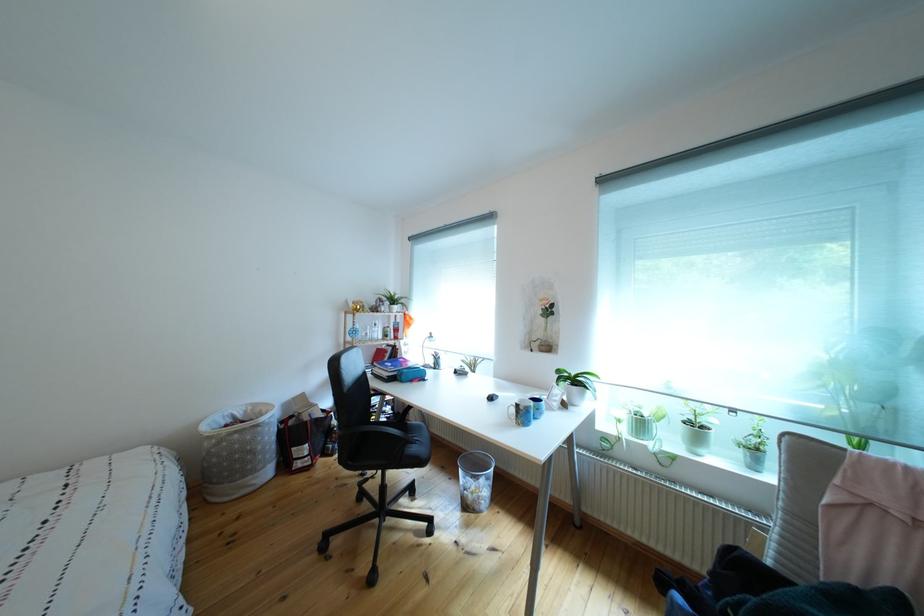
Which object does [410,374] point to?

This point indicates the blue pencil case.